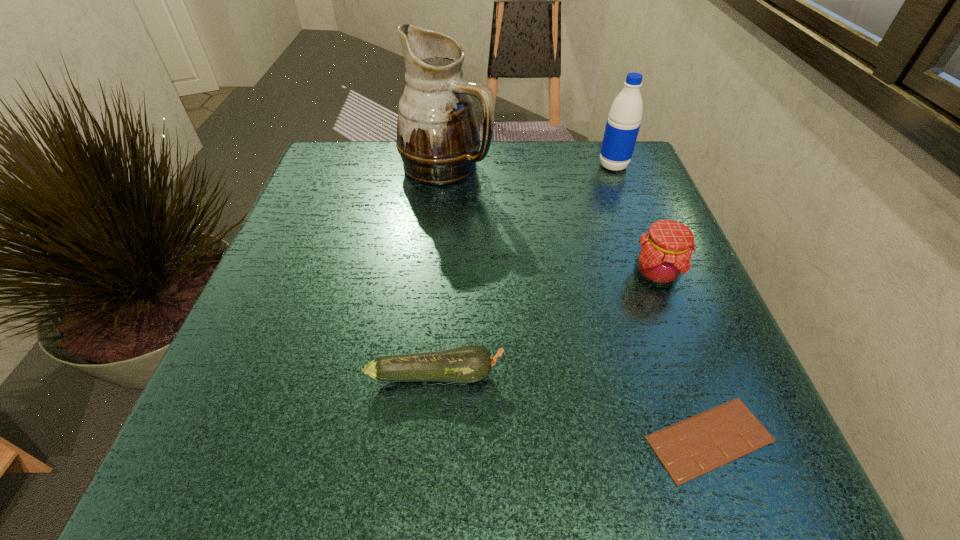
At what (x,y) coordinates should I click in order to perform the action: click on free space located on the left of the third farthest object. Please return your answer as a coordinate pair (x, y). Image resolution: width=960 pixels, height=540 pixels. Looking at the image, I should click on [464, 274].

Locate an element on the screen. The width and height of the screenshot is (960, 540). free spot located 0.230m at the blossom end of the second nearest object is located at coordinates (659, 374).

Where is `vacant space located 0.310m on the left of the shortest object`? vacant space located 0.310m on the left of the shortest object is located at coordinates (411, 439).

The image size is (960, 540). Find the location of `pitcher located at the far edge`. pitcher located at the far edge is located at coordinates (437, 133).

The height and width of the screenshot is (540, 960). Identify the location of water bottle that is at the far edge. (622, 127).

The width and height of the screenshot is (960, 540). I want to click on object that is at the near edge, so click(690, 448).

Locate an element on the screen. water bottle located at the right edge is located at coordinates 622,127.

Find the location of a particular element. Image resolution: width=960 pixels, height=540 pixels. jam that is at the right edge is located at coordinates click(664, 254).

At what (x,y) coordinates should I click in order to perform the action: click on chocolate bar situated at the right edge. Please return your answer as a coordinate pair (x, y). Image resolution: width=960 pixels, height=540 pixels. Looking at the image, I should click on (690, 448).

Identify the location of object situated at the far right corner. (622, 127).